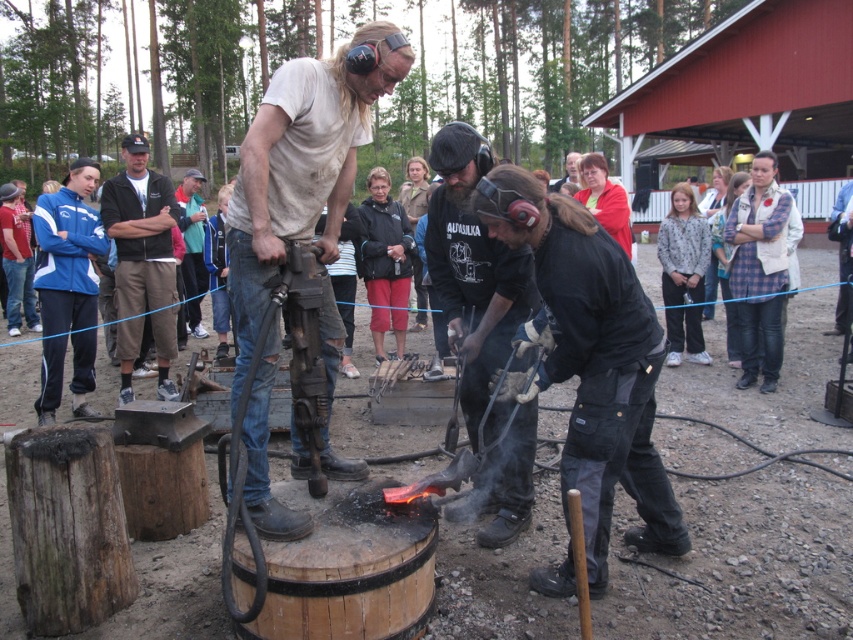
Question: Can you confirm if dirty white shirt at center is positioned above black cotton jacket at upper left?

Choices:
 (A) no
 (B) yes

Answer: (A)

Question: Which point appears farthest from the camera in this image?

Choices:
 (A) (334, 65)
 (B) (519, 508)
 (C) (132, 248)

Answer: (C)

Question: Which point is closer to the camera?

Choices:
 (A) dirty white shirt at center
 (B) black cotton jacket at upper left
 (C) black leather gloves at center

Answer: (A)

Question: Which object is the closest to the black leather gloves at center?

Choices:
 (A) dirty white shirt at center
 (B) black cotton jacket at upper left

Answer: (A)

Question: Is dirty white shirt at center smaller than black cotton jacket at upper left?

Choices:
 (A) yes
 (B) no

Answer: (A)

Question: Does black leather gloves at center have a greater width compared to black cotton jacket at upper left?

Choices:
 (A) yes
 (B) no

Answer: (B)